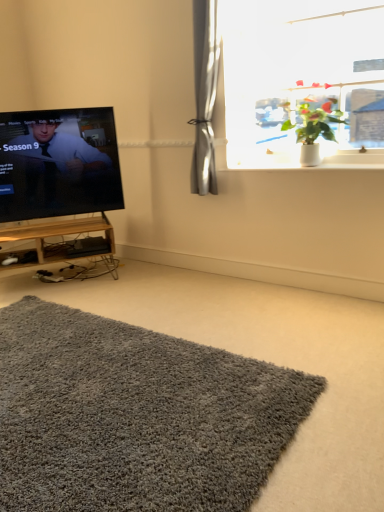
Find the location of a particular element. This screenshot has height=512, width=384. black glossy tv at left is located at coordinates (58, 163).

The image size is (384, 512). I want to click on woodenmaterial tv stand at left, so click(x=64, y=248).

This screenshot has height=512, width=384. I want to click on black glossy tv at left, so click(58, 163).

How far apart are white glossy pot at upper right and gray shaggy rug at lower center?

A distance of 1.64 meters exists between white glossy pot at upper right and gray shaggy rug at lower center.

From the image's perspective, between white glossy pot at upper right and gray shaggy rug at lower center, who is located below?

gray shaggy rug at lower center.

The height and width of the screenshot is (512, 384). I want to click on doormat on the left of white glossy pot at upper right, so click(135, 416).

What's the angular difference between white glossy pot at upper right and black glossy tv at left's facing directions?

The angular difference between white glossy pot at upper right and black glossy tv at left is 50.4 degrees.

Is white glossy pot at upper right beside black glossy tv at left?

No, white glossy pot at upper right is not touching black glossy tv at left.

From the image's perspective, relative to black glossy tv at left, is white glossy pot at upper right above or below?

white glossy pot at upper right is situated higher than black glossy tv at left in the image.

Which object is positioned more to the right, white glossy pot at upper right or black glossy tv at left?

white glossy pot at upper right is more to the right.

Is white glossy window sill at upper right inside black glossy tv at left?

That's incorrect, white glossy window sill at upper right is not inside black glossy tv at left.

From their relative heights in the image, would you say black glossy tv at left is taller or shorter than white glossy window sill at upper right?

Considering their sizes, black glossy tv at left has more height than white glossy window sill at upper right.

From a real-world perspective, is black glossy tv at left over white glossy window sill at upper right?

Yes, from a real-world perspective, black glossy tv at left is on top of white glossy window sill at upper right.

From the image's perspective, which one is positioned lower, black glossy tv at left or white glossy window sill at upper right?

white glossy window sill at upper right.

Would you say white glossy window sill at upper right is inside or outside green leafy plant at upper right?

white glossy window sill at upper right cannot be found inside green leafy plant at upper right.

Is white glossy window sill at upper right placed right next to green leafy plant at upper right?

No, white glossy window sill at upper right is not beside green leafy plant at upper right.

Between white glossy window sill at upper right and green leafy plant at upper right, which one has more height?

green leafy plant at upper right is taller.

From the image's perspective, which one is positioned higher, white glossy window sill at upper right or green leafy plant at upper right?

green leafy plant at upper right, from the image's perspective.

Considering the positions of objects black glossy tv at left and woodenmaterial tv stand at left in the image provided, who is in front, black glossy tv at left or woodenmaterial tv stand at left?

black glossy tv at left is closer to the camera.

Can you tell me how much black glossy tv at left and woodenmaterial tv stand at left differ in facing direction?

There is a 0.000119-degree angle between the facing directions of black glossy tv at left and woodenmaterial tv stand at left.

Considering the relative sizes of black glossy tv at left and woodenmaterial tv stand at left in the image provided, is black glossy tv at left smaller than woodenmaterial tv stand at left?

No, black glossy tv at left is not smaller than woodenmaterial tv stand at left.

Is white glossy window sill at upper right positioned with its back to white glossy pot at upper right?

No, white glossy window sill at upper right is not facing away from white glossy pot at upper right.

Would you say white glossy window sill at upper right is inside or outside white glossy pot at upper right?

white glossy window sill at upper right is not enclosed by white glossy pot at upper right.

From a real-world perspective, does white glossy window sill at upper right sit lower than white glossy pot at upper right?

Yes.

Can you confirm if white glossy window sill at upper right is positioned to the right of white glossy pot at upper right?

No, white glossy window sill at upper right is not to the right of white glossy pot at upper right.

Considering the relative sizes of woodenmaterial tv stand at left and gray shaggy rug at lower center in the image provided, is woodenmaterial tv stand at left taller than gray shaggy rug at lower center?

Indeed, woodenmaterial tv stand at left has a greater height compared to gray shaggy rug at lower center.

Can you confirm if woodenmaterial tv stand at left is thinner than gray shaggy rug at lower center?

Correct, the width of woodenmaterial tv stand at left is less than that of gray shaggy rug at lower center.

From a real-world perspective, which object stands above the other?

In real-world perspective, woodenmaterial tv stand at left is above.

Does woodenmaterial tv stand at left turn towards gray shaggy rug at lower center?

Yes, woodenmaterial tv stand at left is facing gray shaggy rug at lower center.

This screenshot has height=512, width=384. Identify the location of houseplant that appears behind the gray shaggy rug at lower center. (315, 129).

You are a GUI agent. You are given a task and a screenshot of the screen. Output one action in this format:
    pyautogui.click(x=<x>, y=<y>)
    Task: Click on the television that appears below the white glossy pot at upper right (from a real-world perspective)
    
    Given the screenshot: What is the action you would take?
    pyautogui.click(x=58, y=163)

When comparing their distances from white glossy window sill at upper right, does green leafy plant at upper right or gray shaggy rug at lower center seem closer?

green leafy plant at upper right lies closer to white glossy window sill at upper right than the other object.

Considering their positions, is black glossy tv at left positioned closer to woodenmaterial tv stand at left than white glossy window sill at upper right?

Among the two, black glossy tv at left is located nearer to woodenmaterial tv stand at left.

Based on their spatial positions, is green leafy plant at upper right or gray shaggy rug at lower center closer to white glossy pot at upper right?

Based on the image, green leafy plant at upper right appears to be nearer to white glossy pot at upper right.

From the image, which object appears to be nearer to white glossy window sill at upper right, gray shaggy rug at lower center or green leafy plant at upper right?

green leafy plant at upper right.

Estimate the real-world distances between objects in this image. Which object is further from black glossy tv at left, green leafy plant at upper right or white glossy window sill at upper right?

Based on the image, green leafy plant at upper right appears to be further to black glossy tv at left.

From the image, which object appears to be farther from white glossy pot at upper right, gray shaggy rug at lower center or woodenmaterial tv stand at left?

Based on the image, woodenmaterial tv stand at left appears to be further to white glossy pot at upper right.

Which object lies further to the anchor point gray shaggy rug at lower center, black glossy tv at left or green leafy plant at upper right?

green leafy plant at upper right is further to gray shaggy rug at lower center.

Based on their spatial positions, is white glossy window sill at upper right or gray shaggy rug at lower center further from woodenmaterial tv stand at left?

white glossy window sill at upper right lies further to woodenmaterial tv stand at left than the other object.

Locate an element on the screen. The width and height of the screenshot is (384, 512). window sill between black glossy tv at left and white glossy pot at upper right in the horizontal direction is located at coordinates (352, 162).

This screenshot has height=512, width=384. Identify the location of window sill located between woodenmaterial tv stand at left and white glossy pot at upper right in the left-right direction. (352, 162).

This screenshot has height=512, width=384. I want to click on window positioned between gray shaggy rug at lower center and woodenmaterial tv stand at left from near to far, so click(302, 82).

This screenshot has width=384, height=512. I want to click on window sill between black glossy tv at left and green leafy plant at upper right in the horizontal direction, so click(x=352, y=162).